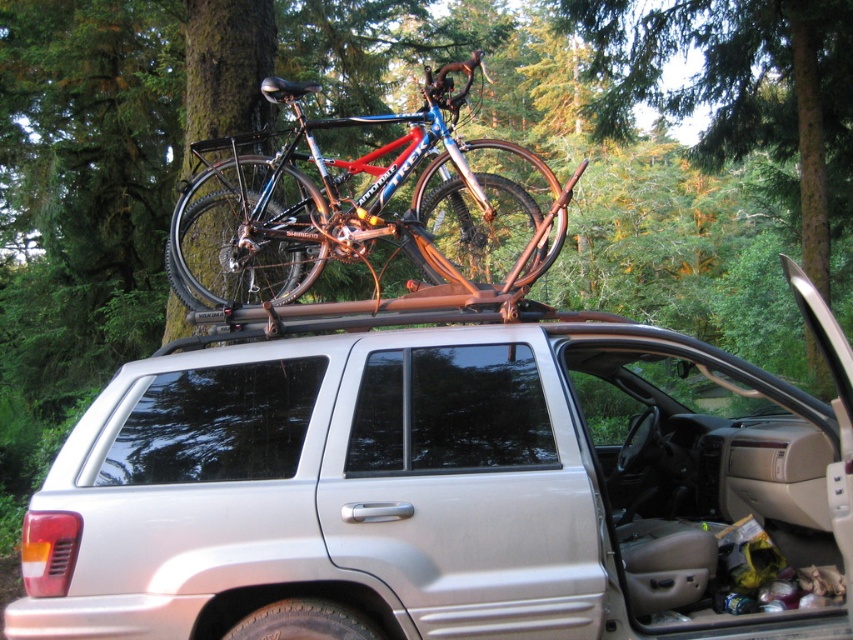
You are planning to load a new item into the silver metallic suv at center. The item is as large as the shiny metallic bicycle at center. Will the item fit inside the suv at center?

The silver metallic suv at center is smaller than the shiny metallic bicycle at center, so the item will not fit inside the suv at center.

You are planning to load a new item into the silver metallic suv at center. Considering the height of the shiny metallic bicycle at center already on the roof rack, will the item with a height of 1.2 meters fit inside the SUV without removing the bicycle?

The silver metallic suv at center is not as tall as the shiny metallic bicycle at center. Since the SUV is shorter than the bicycle, the item with a height of 1.2 meters may not fit inside the SUV without removing the bicycle, as the bicycle might block the space or the SUV itself may not have enough vertical clearance.

You are planning to attach a roof rack to your car for a camping trip. Based on the image, where should you position the roof rack relative to the silver metallic suv at center?

The silver metallic suv at center already has a roof rack installed on top, so you should position the roof rack in the same location on your car to match the setup shown in the image.